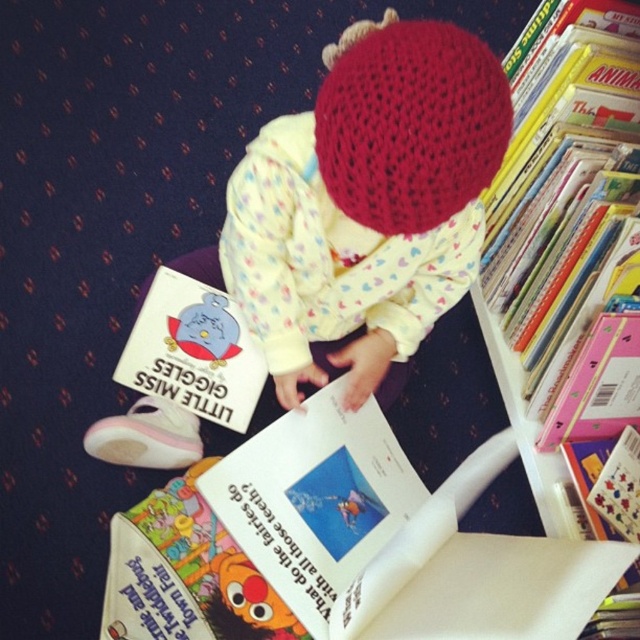
Who is positioned more to the right, knitted wool hat at center or white plastic bookshelf at upper right?

white plastic bookshelf at upper right

Locate an element on the screen. knitted wool hat at center is located at coordinates (364, 205).

You are a GUI agent. You are given a task and a screenshot of the screen. Output one action in this format:
    pyautogui.click(x=<x>, y=<y>)
    Task: Click on the knitted wool hat at center
    
    Given the screenshot: What is the action you would take?
    pyautogui.click(x=364, y=205)